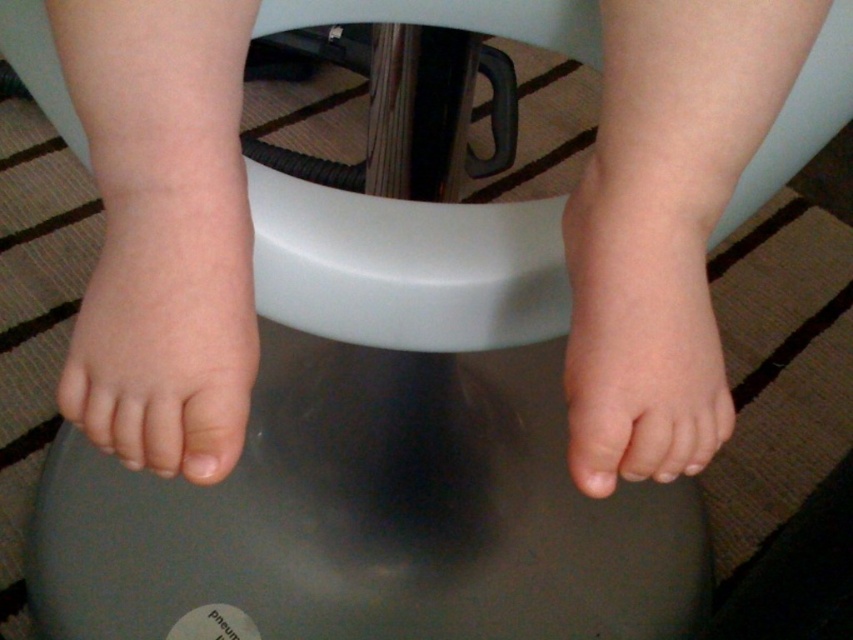
What is the exact location of the smooth skin foot at center in the image?

The smooth skin foot at center is located at point coordinates of (645,310).